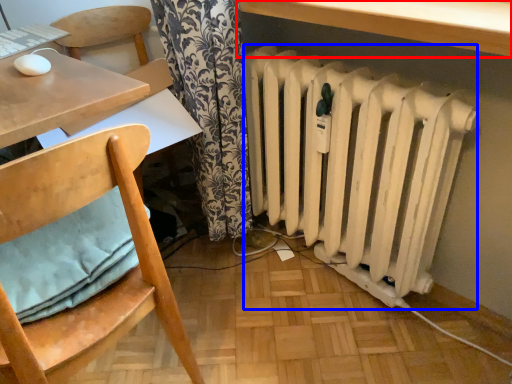
Question: Which object appears closest to the camera in this image, table (highlighted by a red box) or radiator (highlighted by a blue box)?

Choices:
 (A) table
 (B) radiator

Answer: (A)